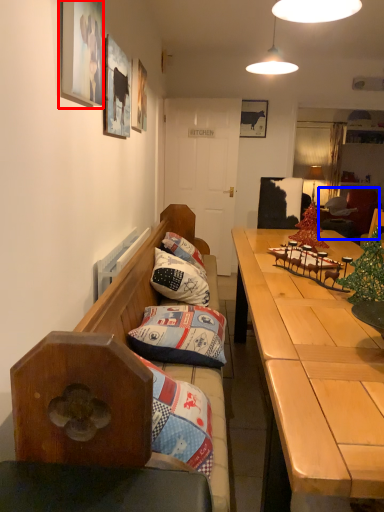
Question: Which of the following is the farthest to the observer, picture frame (highlighted by a red box) or bean bag chair (highlighted by a blue box)?

Choices:
 (A) picture frame
 (B) bean bag chair

Answer: (B)